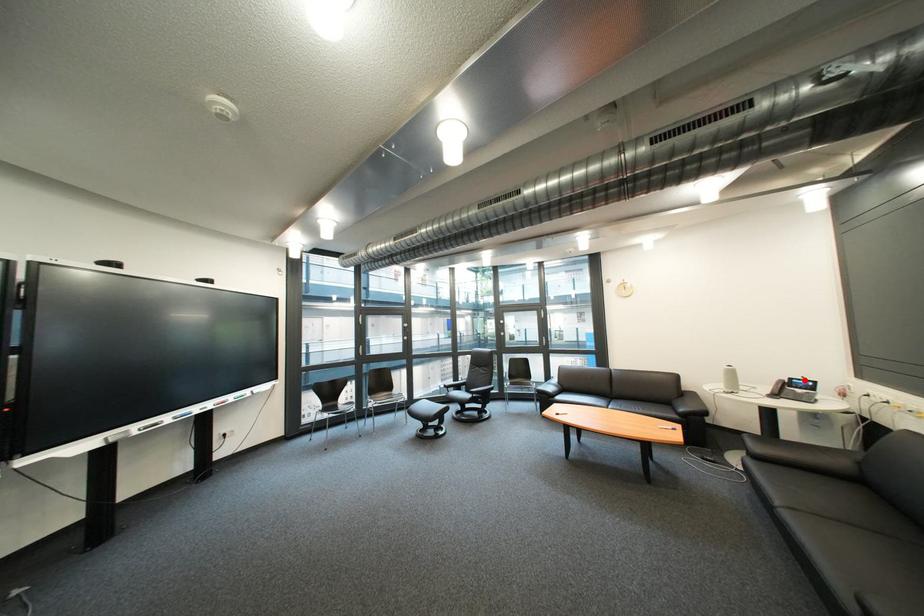
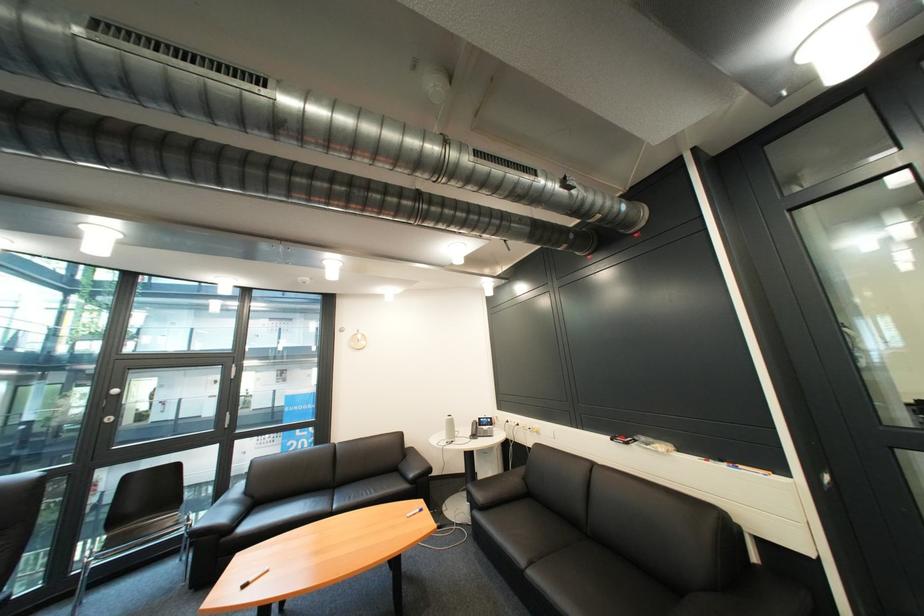
Question: I am providing you with two images of the same scene from different viewpoints. A red point is shown in image1. For the corresponding object point in image2, is it positioned nearer or farther from the camera?

Choices:
 (A) Nearer
 (B) Farther

Answer: (B)